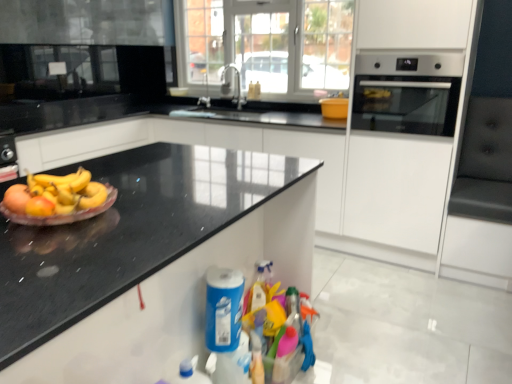
At what (x,y) coordinates should I click in order to perform the action: click on free space above translucent plastic plate at left (from a real-world perspective). Please return your answer as a coordinate pair (x, y). The height and width of the screenshot is (384, 512). Looking at the image, I should click on (82, 196).